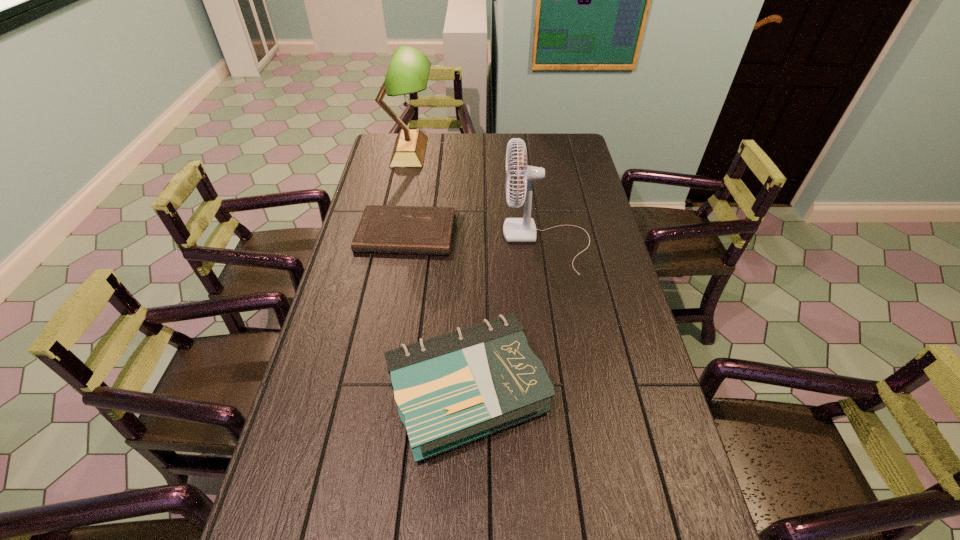
Image resolution: width=960 pixels, height=540 pixels. What are the coordinates of `vacant area that lies between the table lamp and the shorter paperback book` in the screenshot? It's located at (408, 192).

The height and width of the screenshot is (540, 960). Find the location of `free spot between the shorter paperback book and the third shortest object`. free spot between the shorter paperback book and the third shortest object is located at coordinates (476, 238).

In order to click on the second closest object to the farthest object in this screenshot , I will do `click(523, 229)`.

Identify the location of the closest object to the fan. Image resolution: width=960 pixels, height=540 pixels. (382, 229).

Find the location of a particular element. This screenshot has height=540, width=960. vacant point that satisfies the following two spatial constraints: 1. on the back side of the third tallest object; 2. on the metallic stand of the farthest object is located at coordinates (472, 152).

The width and height of the screenshot is (960, 540). What are the coordinates of `free space that satisfies the following two spatial constraints: 1. on the metallic stand of the farthest object; 2. on the right side of the farther paperback book` in the screenshot? It's located at (392, 233).

You are a GUI agent. You are given a task and a screenshot of the screen. Output one action in this format:
    pyautogui.click(x=<x>, y=<y>)
    Task: Click on the free point that satisfies the following two spatial constraints: 1. on the metallic stand of the table lamp; 2. on the left side of the shorter paperback book
    
    Given the screenshot: What is the action you would take?
    pyautogui.click(x=392, y=233)

The width and height of the screenshot is (960, 540). I want to click on vacant region that satisfies the following two spatial constraints: 1. on the metallic stand of the table lamp; 2. on the left side of the nearest object, so click(358, 392).

This screenshot has height=540, width=960. What are the coordinates of `free region that satisfies the following two spatial constraints: 1. on the metallic stand of the taller paperback book; 2. on the right side of the table lamp` in the screenshot? It's located at (358, 392).

At what (x,y) coordinates should I click in order to perform the action: click on free space in the image that satisfies the following two spatial constraints: 1. on the metallic stand of the farther paperback book; 2. on the left side of the table lamp. Please return your answer as a coordinate pair (x, y). The image size is (960, 540). Looking at the image, I should click on 392,233.